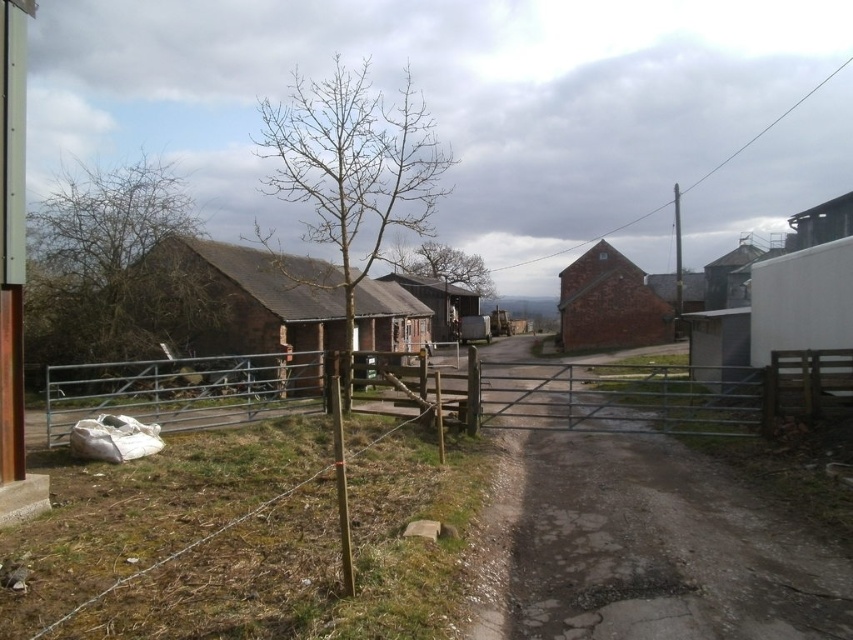
Who is more forward, (51, 320) or (479, 298)?

Positioned in front is point (51, 320).

Does brown leafless tree at left have a smaller size compared to brown wooden hut at center?

No.

Does point (135, 177) come farther from viewer compared to point (448, 314)?

No, (135, 177) is closer to viewer.

Identify the location of brown leafless tree at left. This screenshot has width=853, height=640. (108, 268).

Between point (96, 248) and point (614, 268), which one is positioned in front?

Point (96, 248) is more forward.

Is brown leafless tree at left below brown brick house at center-right?

Incorrect, brown leafless tree at left is not positioned below brown brick house at center-right.

Who is more distant from viewer, (163, 337) or (614, 342)?

The point (614, 342) is behind.

This screenshot has width=853, height=640. I want to click on brown leafless tree at left, so click(108, 268).

Can you confirm if brown wooden hut at left is shorter than brown brick house at center-right?

Yes.

The width and height of the screenshot is (853, 640). Describe the element at coordinates (238, 298) in the screenshot. I see `brown wooden hut at left` at that location.

Image resolution: width=853 pixels, height=640 pixels. Find the location of `brown wooden hut at left`. brown wooden hut at left is located at coordinates (238, 298).